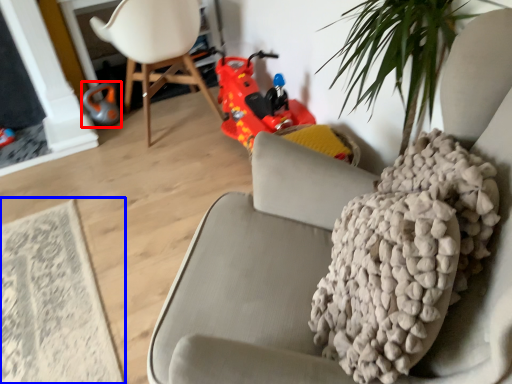
Question: Among these objects, which one is farthest to the camera, toy (highlighted by a red box) or mat (highlighted by a blue box)?

Choices:
 (A) toy
 (B) mat

Answer: (A)